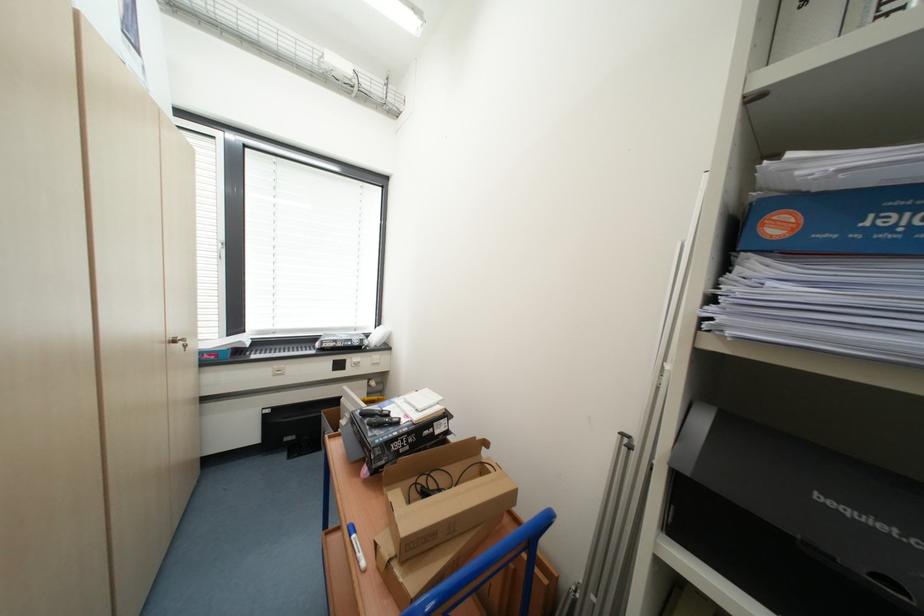
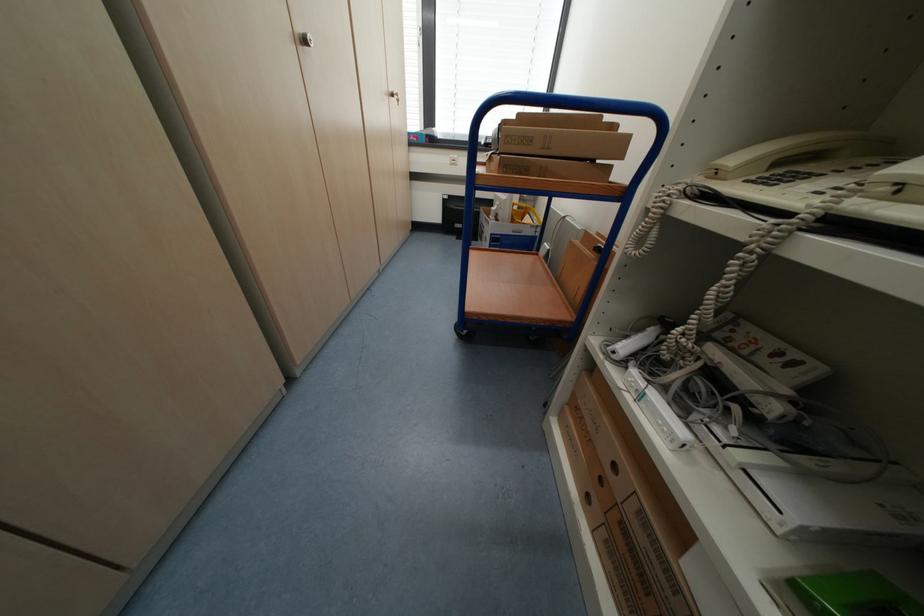
In the second image, find the point that corresponds to pixel 180 342 in the first image.

(398, 95)